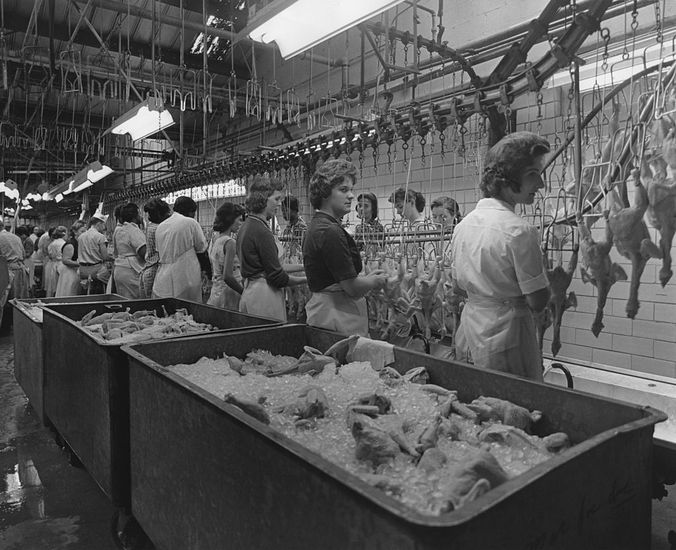
In order to click on overhead light in this screenshot , I will do `click(316, 16)`, `click(139, 124)`, `click(97, 173)`, `click(84, 185)`, `click(67, 185)`, `click(45, 190)`, `click(38, 190)`, `click(589, 68)`, `click(220, 184)`.